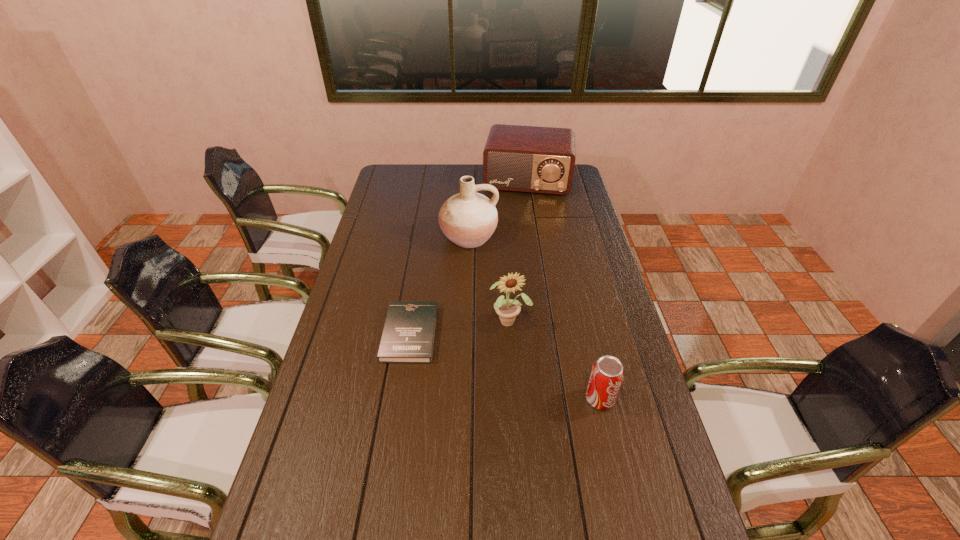
Identify the location of vacant space located 0.080m to pour from the handle of the second farthest object. The width and height of the screenshot is (960, 540). (471, 268).

Identify the location of vacant space located on the front panel of the radio receiver. (518, 239).

Find the location of a particular element. The height and width of the screenshot is (540, 960). vacant space located 0.170m on the front panel of the radio receiver is located at coordinates (520, 221).

This screenshot has height=540, width=960. What are the coordinates of `vacant region located on the front panel of the radio receiver` in the screenshot? It's located at (518, 235).

Where is `free space located 0.400m on the front-facing side of the sunflower`? Image resolution: width=960 pixels, height=540 pixels. free space located 0.400m on the front-facing side of the sunflower is located at coordinates (548, 451).

This screenshot has width=960, height=540. Identify the location of free region located 0.260m on the front-facing side of the sunflower. (534, 402).

You are a GUI agent. You are given a task and a screenshot of the screen. Output one action in this format:
    pyautogui.click(x=<x>, y=<y>)
    Task: Click on the vacant space located on the front-facing side of the sunflower
    The height and width of the screenshot is (540, 960).
    Given the screenshot: What is the action you would take?
    pyautogui.click(x=539, y=418)

The width and height of the screenshot is (960, 540). I want to click on object situated at the far edge, so click(x=534, y=159).

This screenshot has width=960, height=540. In order to click on soda can located in the right edge section of the desktop in this screenshot , I will do pyautogui.click(x=607, y=374).

Image resolution: width=960 pixels, height=540 pixels. Find the location of `radio receiver that is positioned at the right edge`. radio receiver that is positioned at the right edge is located at coordinates (534, 159).